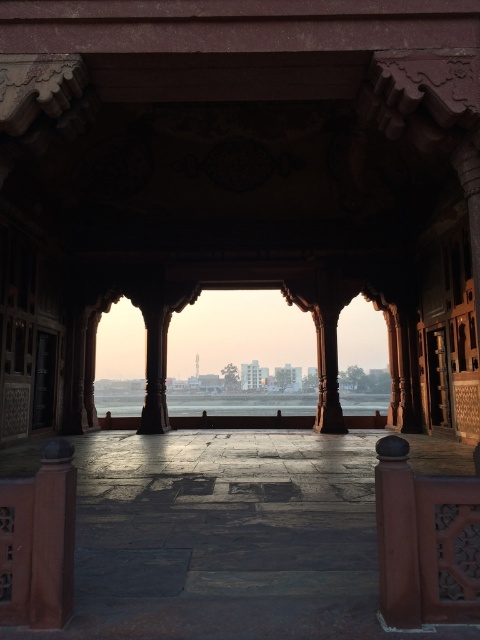
You are standing in the corridor and want to move towards the distant cityscape. Which pillar, the polished stone pillar at center or the smooth stone pillar at center, would you need to go around first?

The polished stone pillar at center is in front of the smooth stone pillar at center, so you would need to go around the polished stone pillar at center first before reaching the smooth stone pillar at center.